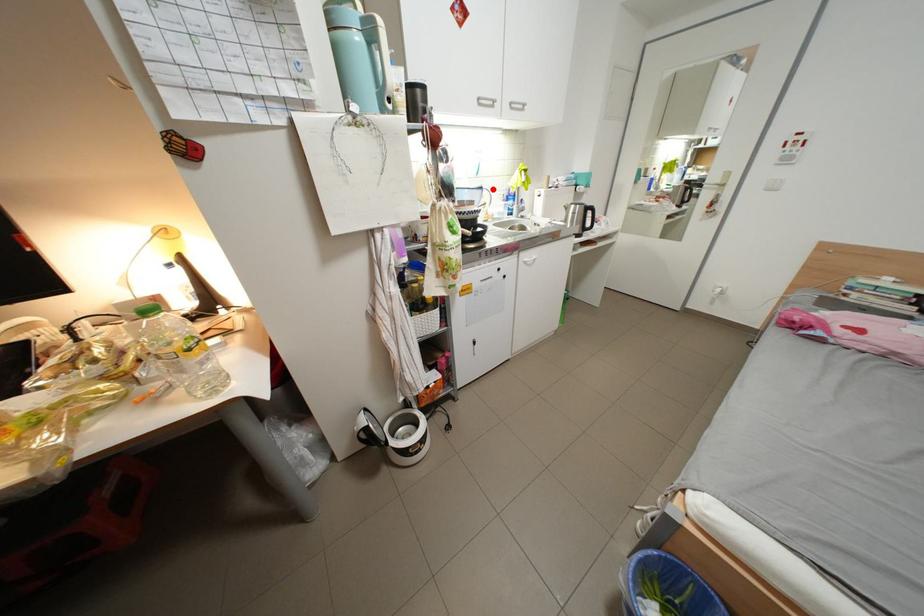
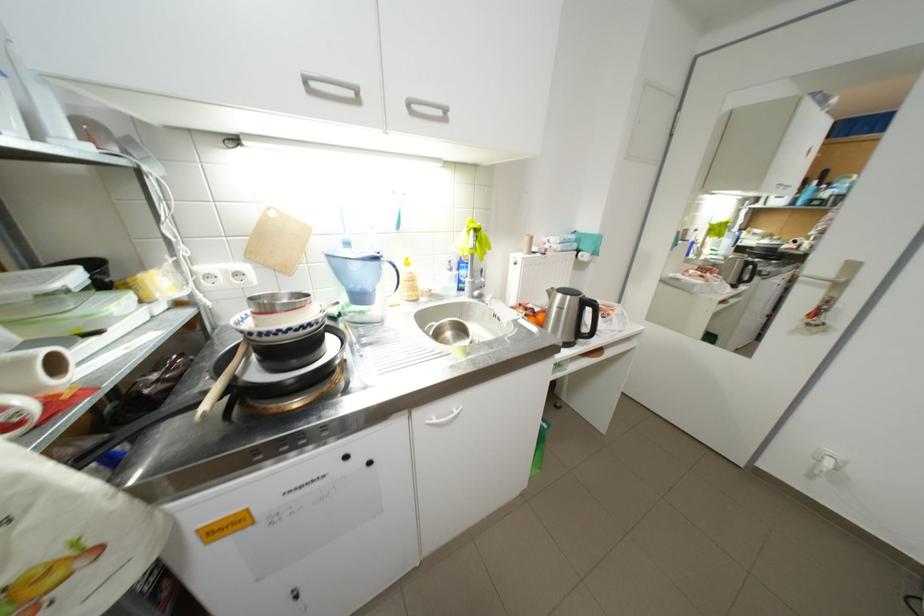
Find the pixel in the second image that matches the highlighted location in the first image.

(387, 259)